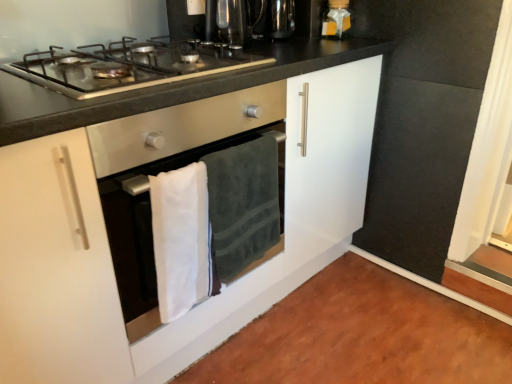
Question: Considering the relative positions of matte gold gift box at upper right and stainless steel gas stove at upper center in the image provided, is matte gold gift box at upper right in front of stainless steel gas stove at upper center?

Choices:
 (A) yes
 (B) no

Answer: (B)

Question: Would you say matte gold gift box at upper right is outside stainless steel gas stove at upper center?

Choices:
 (A) yes
 (B) no

Answer: (A)

Question: Is the surface of matte gold gift box at upper right in direct contact with stainless steel gas stove at upper center?

Choices:
 (A) yes
 (B) no

Answer: (B)

Question: Is matte gold gift box at upper right behind stainless steel gas stove at upper center?

Choices:
 (A) no
 (B) yes

Answer: (B)

Question: Is matte gold gift box at upper right smaller than stainless steel gas stove at upper center?

Choices:
 (A) yes
 (B) no

Answer: (A)

Question: Which is correct: metallic black coffee machine at upper center is inside dark green plush towel at center, which appears as the second bath towel when viewed from the left, or outside of it?

Choices:
 (A) outside
 (B) inside

Answer: (A)

Question: From a real-world perspective, is metallic black coffee machine at upper center above or below dark green plush towel at center, which appears as the second bath towel when viewed from the left?

Choices:
 (A) below
 (B) above

Answer: (B)

Question: From the image's perspective, relative to dark green plush towel at center, the 1th bath towel in the right-to-left sequence, is metallic black coffee machine at upper center above or below?

Choices:
 (A) below
 (B) above

Answer: (B)

Question: Looking at the image, does metallic black coffee machine at upper center seem bigger or smaller compared to dark green plush towel at center, which appears as the second bath towel when viewed from the left?

Choices:
 (A) small
 (B) big

Answer: (A)

Question: Would you say stainless steel gas stove at upper center is to the left or to the right of metallic black coffee machine at upper center in the picture?

Choices:
 (A) left
 (B) right

Answer: (A)

Question: From a real-world perspective, is stainless steel gas stove at upper center above or below metallic black coffee machine at upper center?

Choices:
 (A) below
 (B) above

Answer: (A)

Question: Considering the positions of stainless steel gas stove at upper center and metallic black coffee machine at upper center in the image, is stainless steel gas stove at upper center taller or shorter than metallic black coffee machine at upper center?

Choices:
 (A) short
 (B) tall

Answer: (A)

Question: Based on their sizes in the image, would you say stainless steel gas stove at upper center is bigger or smaller than metallic black coffee machine at upper center?

Choices:
 (A) small
 (B) big

Answer: (B)

Question: Is white glossy cabinet at center spatially inside stainless steel gas stove at upper center, or outside of it?

Choices:
 (A) outside
 (B) inside

Answer: (A)

Question: Considering the positions of white glossy cabinet at center and stainless steel gas stove at upper center in the image, is white glossy cabinet at center bigger or smaller than stainless steel gas stove at upper center?

Choices:
 (A) big
 (B) small

Answer: (A)